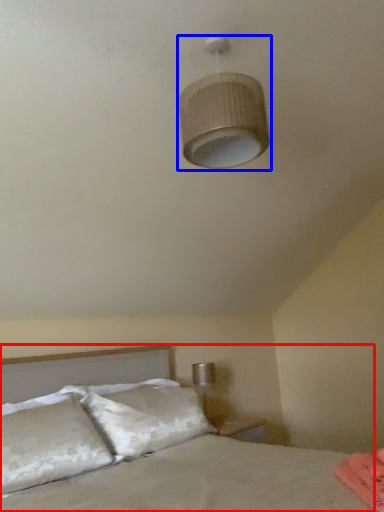
Question: Which object appears farthest to the camera in this image, bed (highlighted by a red box) or lamp (highlighted by a blue box)?

Choices:
 (A) bed
 (B) lamp

Answer: (B)